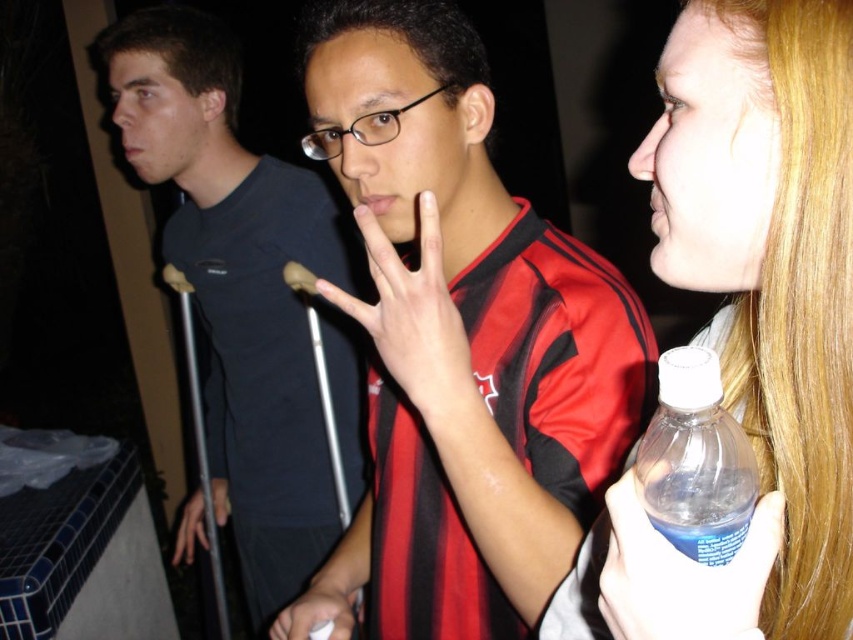
Question: Is translucent plastic bottle at upper right to the left of matte black hand at center from the viewer's perspective?

Choices:
 (A) yes
 (B) no

Answer: (B)

Question: Is white matte hand at center below metal crutches at center?

Choices:
 (A) no
 (B) yes

Answer: (A)

Question: In this image, where is clear plastic bottle at right located relative to matte black hand at center?

Choices:
 (A) above
 (B) below

Answer: (B)

Question: Which point appears closest to the camera in this image?

Choices:
 (A) (x=347, y=176)
 (B) (x=445, y=355)
 (C) (x=207, y=296)
 (D) (x=741, y=392)

Answer: (D)

Question: Based on their relative distances, which object is farther from the clear plastic bottle at upper right?

Choices:
 (A) metal crutches at center
 (B) matte black hand at center
 (C) white matte hand at center
 (D) matte black shirt at center

Answer: (A)

Question: Which point appears farthest from the camera in this image?

Choices:
 (A) (213, 492)
 (B) (624, 573)

Answer: (A)